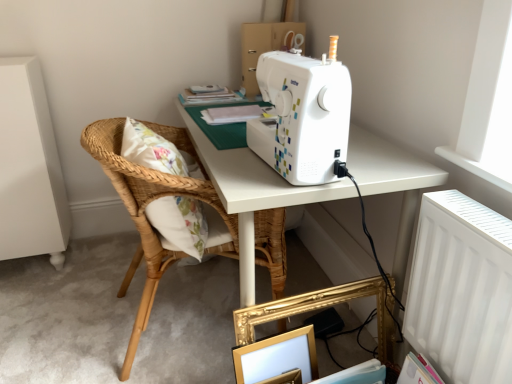
Find the location of `empty space that is ontop of white paper at upper center`. empty space that is ontop of white paper at upper center is located at coordinates (236, 106).